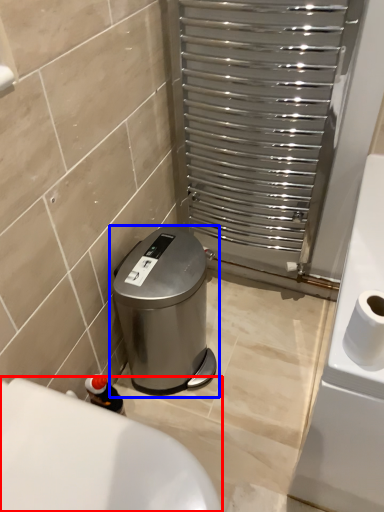
Question: Which object is closer to the camera taking this photo, bath (highlighted by a red box) or waste container (highlighted by a blue box)?

Choices:
 (A) bath
 (B) waste container

Answer: (A)